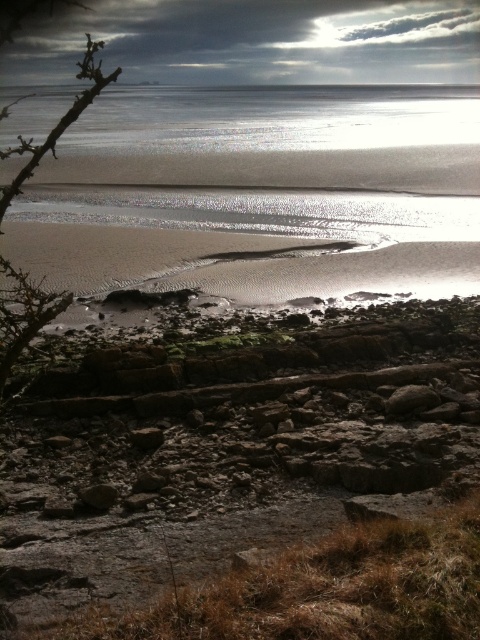
Question: From the image, what is the correct spatial relationship of shiny metallic water at upper center in relation to brown thorny branch at left?

Choices:
 (A) above
 (B) below

Answer: (B)

Question: Is shiny metallic water at upper center positioned before brown thorny branch at left?

Choices:
 (A) no
 (B) yes

Answer: (A)

Question: Can you confirm if shiny metallic water at upper center is thinner than brown thorny branch at left?

Choices:
 (A) no
 (B) yes

Answer: (A)

Question: Which point appears farthest from the camera in this image?

Choices:
 (A) (27, 292)
 (B) (180, 179)

Answer: (B)

Question: Which point appears closest to the camera in this image?

Choices:
 (A) (21, 337)
 (B) (46, 100)

Answer: (A)

Question: Which of the following is the farthest from the observer?

Choices:
 (A) (215, 125)
 (B) (8, 326)

Answer: (A)